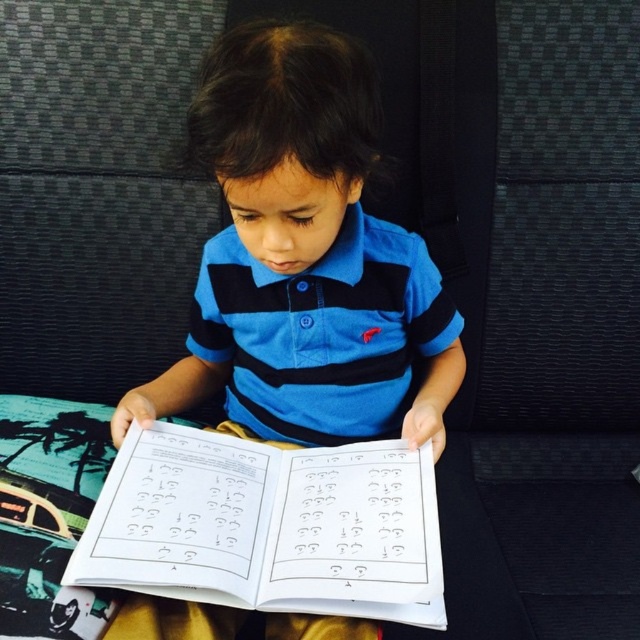
Looking at this image, can you confirm if blue striped shirt at center is smaller than blue striped polo shirt at center?

No.

Does blue striped shirt at center have a larger size compared to blue striped polo shirt at center?

Indeed, blue striped shirt at center has a larger size compared to blue striped polo shirt at center.

Find the location of `blue striped shirt at center`. blue striped shirt at center is located at coordinates (305, 259).

Which is more to the left, blue striped shirt at center or white paper journal at center?

white paper journal at center

Between blue striped shirt at center and white paper journal at center, which one is positioned higher?

blue striped shirt at center is above.

The image size is (640, 640). What are the coordinates of `blue striped shirt at center` in the screenshot? It's located at (305, 259).

Between white paper journal at center and blue striped polo shirt at center, which one is positioned higher?

Positioned higher is blue striped polo shirt at center.

Can you confirm if white paper journal at center is smaller than blue striped polo shirt at center?

Yes, white paper journal at center is smaller than blue striped polo shirt at center.

This screenshot has width=640, height=640. In order to click on white paper journal at center in this screenshot , I will do `click(268, 525)`.